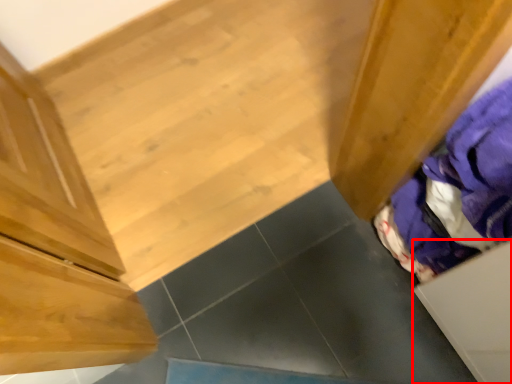
Question: From the image's perspective, where is drawer (annotated by the red box) located relative to clothing?

Choices:
 (A) below
 (B) above

Answer: (A)